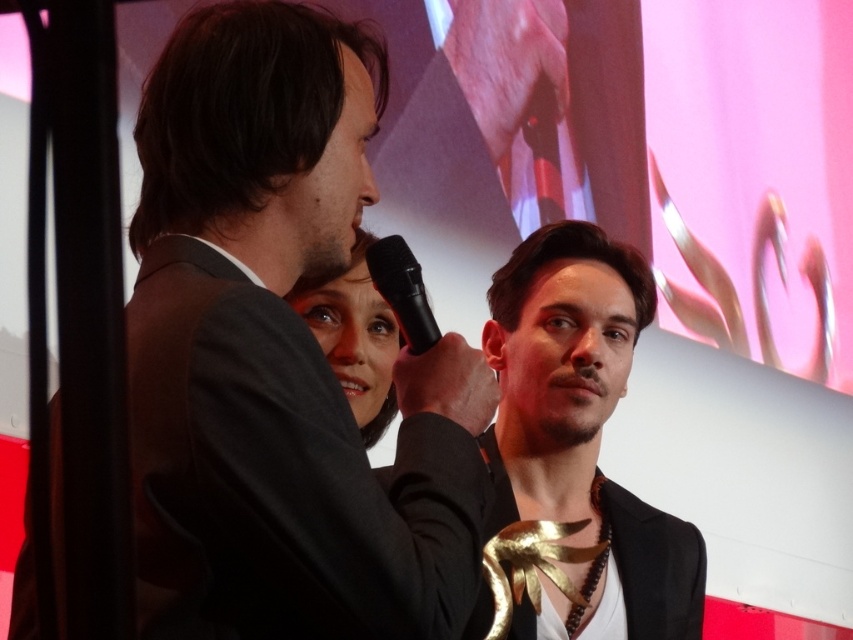
You are an event organizer checking the stage setup. You need to ensure that the black plastic microphone at center is visible to the audience. Given that the black matte suit at center is worn by a speaker, could the microphone be obscured by the speaker?

The black matte suit at center might be wider than black plastic microphone at center, so there is a possibility that the speaker wearing the black matte suit at center could obscure the black plastic microphone at center from certain angles.